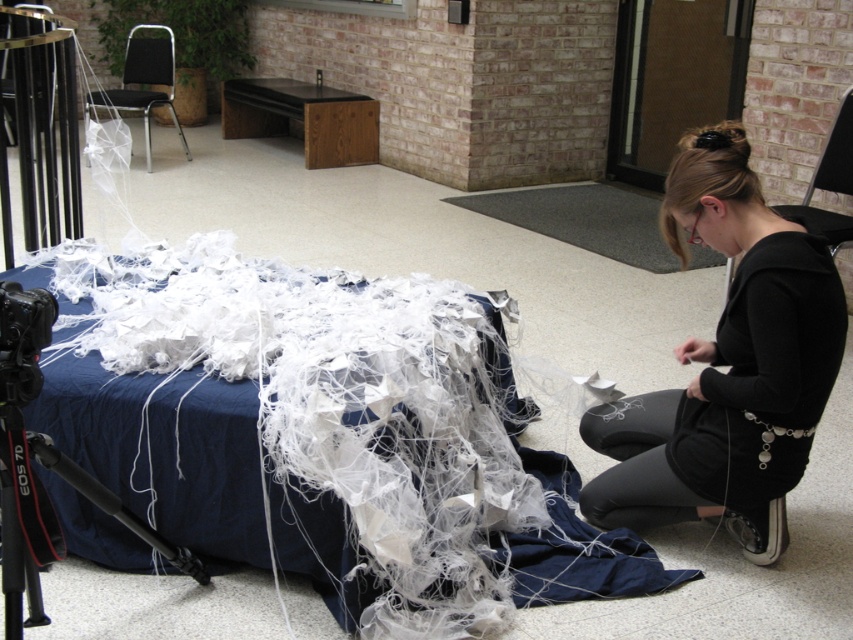
Is black metal tripod at lower left to the right of black plastic chair at upper left from the viewer's perspective?

Yes, black metal tripod at lower left is to the right of black plastic chair at upper left.

Does point (0, 492) lie behind point (122, 102)?

No.

The width and height of the screenshot is (853, 640). What do you see at coordinates (39, 499) in the screenshot?
I see `black metal tripod at lower left` at bounding box center [39, 499].

Locate an element on the screen. Image resolution: width=853 pixels, height=640 pixels. black metal tripod at lower left is located at coordinates (39, 499).

Does black metal tripod at lower left appear over metallic silver chair at upper left?

Actually, black metal tripod at lower left is below metallic silver chair at upper left.

The height and width of the screenshot is (640, 853). In order to click on black metal tripod at lower left in this screenshot , I will do `click(39, 499)`.

Find the location of a particular element. black metal tripod at lower left is located at coordinates (39, 499).

At what (x,y) coordinates should I click in order to perform the action: click on black metal tripod at lower left. Please return your answer as a coordinate pair (x, y). This screenshot has height=640, width=853. Looking at the image, I should click on (39, 499).

Does metallic silver chair at upper left have a greater height compared to black plastic chair at upper left?

Incorrect, metallic silver chair at upper left's height is not larger of black plastic chair at upper left's.

Does metallic silver chair at upper left have a lesser height compared to black plastic chair at upper left?

Correct, metallic silver chair at upper left is not as tall as black plastic chair at upper left.

Is point (9, 33) farther from camera compared to point (149, 58)?

No.

Find the location of a particular element. This screenshot has width=853, height=640. metallic silver chair at upper left is located at coordinates (30, 90).